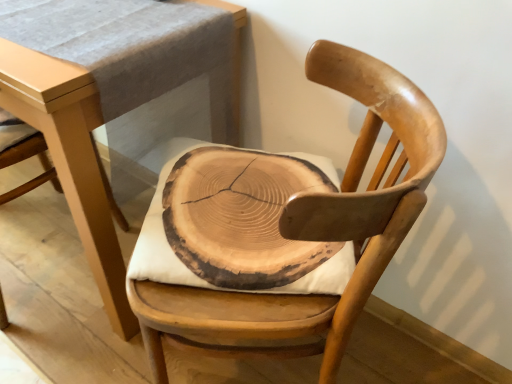
The width and height of the screenshot is (512, 384). Describe the element at coordinates (71, 158) in the screenshot. I see `light brown wood table at center` at that location.

What is the approximate width of light brown wood table at center?

The width of light brown wood table at center is 20.05 inches.

At what (x,y) coordinates should I click in order to perform the action: click on wooden slice cushion at center. Please return your answer as a coordinate pair (x, y). The height and width of the screenshot is (384, 512). Looking at the image, I should click on (240, 217).

Is natural wood chair at center in contact with wooden slice cushion at center?

Yes, natural wood chair at center is next to wooden slice cushion at center.

Is natural wood chair at center turned away from wooden slice cushion at center?

Yes, wooden slice cushion at center is at the back of natural wood chair at center.

From the image's perspective, which object appears higher, natural wood chair at center or wooden slice cushion at center?

wooden slice cushion at center is shown above in the image.

Measure the distance from natural wood chair at center to wooden slice cushion at center.

natural wood chair at center and wooden slice cushion at center are 2.22 inches apart from each other.

Is light brown wood table at center aimed at natural wood chair at center?

No, light brown wood table at center does not turn towards natural wood chair at center.

At what (x,y) coordinates should I click in order to perform the action: click on table that is behind the natural wood chair at center. Please return your answer as a coordinate pair (x, y). The height and width of the screenshot is (384, 512). Looking at the image, I should click on (71, 158).

Which of these two, light brown wood table at center or natural wood chair at center, stands taller?

With more height is natural wood chair at center.

The width and height of the screenshot is (512, 384). I want to click on chair below the wooden slice cushion at center (from a real-world perspective), so click(288, 225).

Is point (213, 180) closer to camera compared to point (426, 117)?

No.

Is wooden slice cushion at center to the right of natural wood chair at center from the viewer's perspective?

In fact, wooden slice cushion at center is to the left of natural wood chair at center.

Based on their positions, is natural wood chair at center located to the left or right of light brown wood table at center?

From the image, it's evident that natural wood chair at center is to the right of light brown wood table at center.

Can you confirm if natural wood chair at center is shorter than light brown wood table at center?

Incorrect, the height of natural wood chair at center does not fall short of that of light brown wood table at center.

Considering the relative sizes of natural wood chair at center and light brown wood table at center in the image provided, is natural wood chair at center smaller than light brown wood table at center?

Correct, natural wood chair at center occupies less space than light brown wood table at center.

From a real-world perspective, who is located lower, natural wood chair at center or light brown wood table at center?

light brown wood table at center.

How much distance is there between wooden slice cushion at center and light brown wood table at center?

The distance of wooden slice cushion at center from light brown wood table at center is 11.07 inches.

Considering the sizes of objects wooden slice cushion at center and light brown wood table at center in the image provided, who is taller, wooden slice cushion at center or light brown wood table at center?

light brown wood table at center is taller.

Does wooden slice cushion at center come in front of light brown wood table at center?

No, wooden slice cushion at center is further to the viewer.

Identify the location of pad positioned vertically above the light brown wood table at center (from a real-world perspective). (240, 217).

Can you see light brown wood table at center touching wooden slice cushion at center?

No, light brown wood table at center is not next to wooden slice cushion at center.

The height and width of the screenshot is (384, 512). Identify the location of pad above the light brown wood table at center (from a real-world perspective). (240, 217).

Is light brown wood table at center at the right side of wooden slice cushion at center?

No, light brown wood table at center is not to the right of wooden slice cushion at center.

From the image's perspective, would you say light brown wood table at center is shown under wooden slice cushion at center?

No, from the image's perspective, light brown wood table at center is not beneath wooden slice cushion at center.

In the image, there is a natural wood chair at center. Identify the location of pad above it (from the image's perspective). (240, 217).

Image resolution: width=512 pixels, height=384 pixels. Find the location of `table behind the natural wood chair at center`. table behind the natural wood chair at center is located at coordinates (71, 158).

From the picture: When comparing their distances from light brown wood table at center, does natural wood chair at center or wooden slice cushion at center seem further?

natural wood chair at center is further to light brown wood table at center.

Which object lies further to the anchor point natural wood chair at center, light brown wood table at center or wooden slice cushion at center?

light brown wood table at center is positioned further to the anchor natural wood chair at center.

When comparing their distances from wooden slice cushion at center, does natural wood chair at center or light brown wood table at center seem closer?

Based on the image, natural wood chair at center appears to be nearer to wooden slice cushion at center.

Which object lies nearer to the anchor point light brown wood table at center, wooden slice cushion at center or natural wood chair at center?

Based on the image, wooden slice cushion at center appears to be nearer to light brown wood table at center.

Which object lies further to the anchor point natural wood chair at center, wooden slice cushion at center or light brown wood table at center?

light brown wood table at center.

Considering their positions, is light brown wood table at center positioned further to wooden slice cushion at center than natural wood chair at center?

light brown wood table at center.

You are a GUI agent. You are given a task and a screenshot of the screen. Output one action in this format:
    pyautogui.click(x=<x>, y=<y>)
    Task: Click on the pad between light brown wood table at center and natural wood chair at center
    Image resolution: width=512 pixels, height=384 pixels.
    Given the screenshot: What is the action you would take?
    pyautogui.click(x=240, y=217)